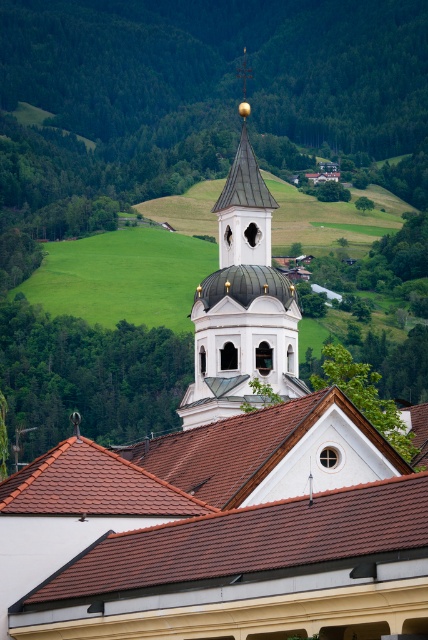
Question: Which point is farther from the camera taking this photo?

Choices:
 (A) (362, 552)
 (B) (291, 296)

Answer: (B)

Question: Does brown tile roof at center have a lesser width compared to white glossy bell tower at center?

Choices:
 (A) yes
 (B) no

Answer: (B)

Question: Which point is farther from the camera taking this photo?

Choices:
 (A) (261, 516)
 (B) (225, 333)

Answer: (B)

Question: From the image, what is the correct spatial relationship of brown tile roof at center in relation to white glossy bell tower at center?

Choices:
 (A) above
 (B) below

Answer: (B)

Question: Is brown tile roof at center wider than white glossy bell tower at center?

Choices:
 (A) yes
 (B) no

Answer: (A)